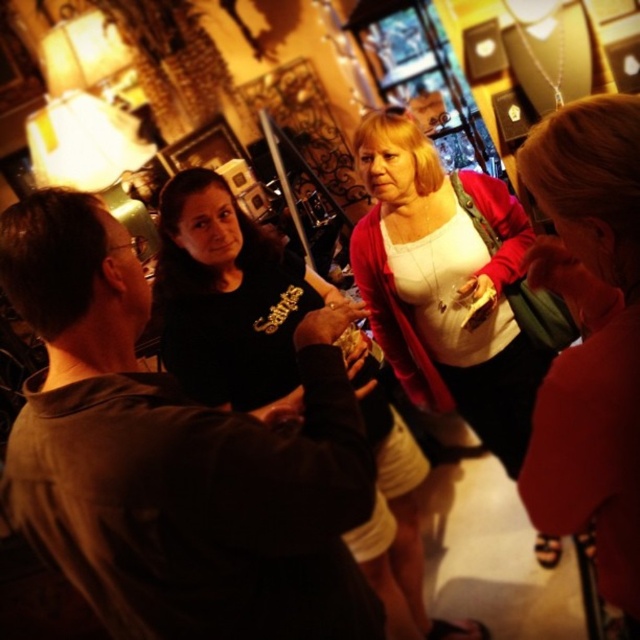
Question: Which point appears closest to the camera in this image?

Choices:
 (A) (609, 148)
 (B) (406, 609)
 (C) (515, 474)

Answer: (A)

Question: Does dark brown leather jacket at center have a larger size compared to matte red shirt at center?

Choices:
 (A) yes
 (B) no

Answer: (A)

Question: Among these objects, which one is farthest from the camera?

Choices:
 (A) dark brown leather jacket at center
 (B) matte red shirt at center

Answer: (A)

Question: Is matte red shirt at center wider than black matte shirt at center?

Choices:
 (A) no
 (B) yes

Answer: (A)

Question: Among these points, which one is farthest from the camera?

Choices:
 (A) (576, 211)
 (B) (212, 595)
 (C) (408, 636)
 (D) (392, 336)

Answer: (C)

Question: From the image, what is the correct spatial relationship of matte red shirt at center in relation to black matte shirt at center?

Choices:
 (A) left
 (B) right

Answer: (B)